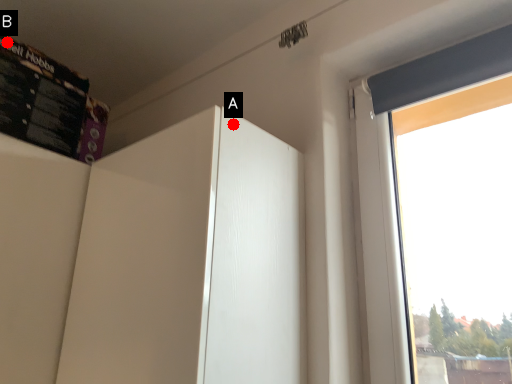
Question: Two points are circled on the image, labeled by A and B beside each circle. Which point is farther to the camera?

Choices:
 (A) A is further
 (B) B is further

Answer: (B)